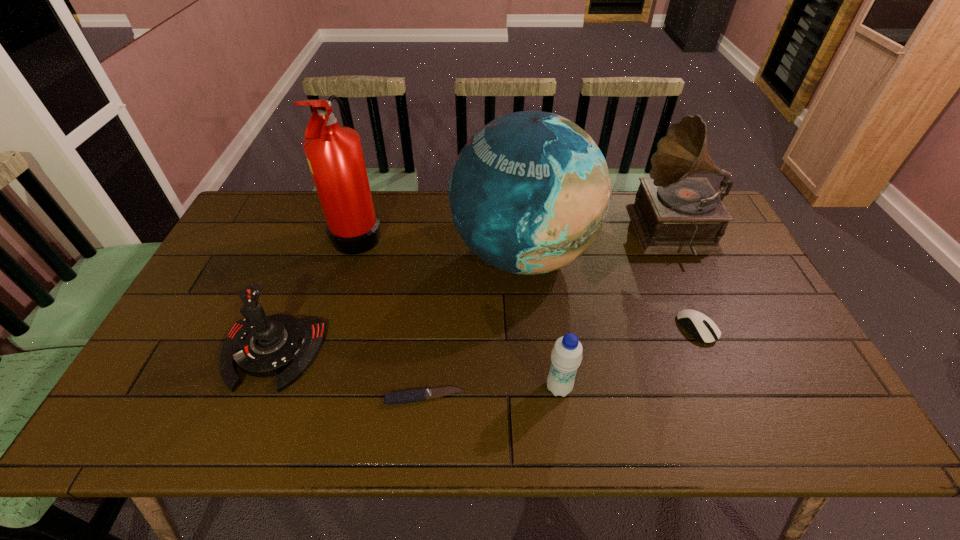
Where is `vacant space that satisfies the following two spatial constraints: 1. on the back side of the shortest object; 2. on the right side of the water bottle`? vacant space that satisfies the following two spatial constraints: 1. on the back side of the shortest object; 2. on the right side of the water bottle is located at coordinates (425, 388).

Locate an element on the screen. This screenshot has height=540, width=960. vacant position in the image that satisfies the following two spatial constraints: 1. on the back side of the sixth tallest object; 2. at the spray nozzle of the fire extinguisher is located at coordinates (657, 232).

Where is `vacant region that satisfies the following two spatial constraints: 1. at the spray nozzle of the globe; 2. on the right side of the fire extinguisher`? vacant region that satisfies the following two spatial constraints: 1. at the spray nozzle of the globe; 2. on the right side of the fire extinguisher is located at coordinates (352, 254).

Locate an element on the screen. Image resolution: width=960 pixels, height=540 pixels. free location that satisfies the following two spatial constraints: 1. from the horn of the fifth shortest object; 2. on the handle side of the joystick is located at coordinates (732, 353).

You are a GUI agent. You are given a task and a screenshot of the screen. Output one action in this format:
    pyautogui.click(x=<x>, y=<y>)
    Task: Click on the free spot that satisfies the following two spatial constraints: 1. at the spray nozzle of the fire extinguisher; 2. on the handle side of the joystick
    This screenshot has height=540, width=960.
    Given the screenshot: What is the action you would take?
    pyautogui.click(x=323, y=353)

The height and width of the screenshot is (540, 960). Find the location of `vacant space that satisfies the following two spatial constraints: 1. at the spray nozzle of the steak knife; 2. on the right side of the fire extinguisher`. vacant space that satisfies the following two spatial constraints: 1. at the spray nozzle of the steak knife; 2. on the right side of the fire extinguisher is located at coordinates (310, 397).

This screenshot has height=540, width=960. I want to click on vacant area in the image that satisfies the following two spatial constraints: 1. at the spray nozzle of the fire extinguisher; 2. on the left side of the water bottle, so click(x=313, y=388).